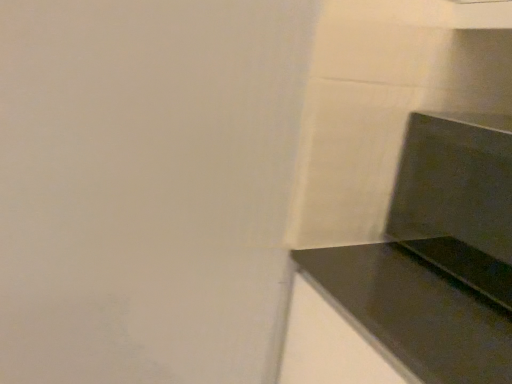
The image size is (512, 384). What do you see at coordinates (458, 199) in the screenshot? I see `metallic gray laptop at right` at bounding box center [458, 199].

At what (x,y) coordinates should I click in order to perform the action: click on metallic gray laptop at right. Please return your answer as a coordinate pair (x, y). Looking at the image, I should click on coord(458,199).

I want to click on metallic gray laptop at right, so pos(458,199).